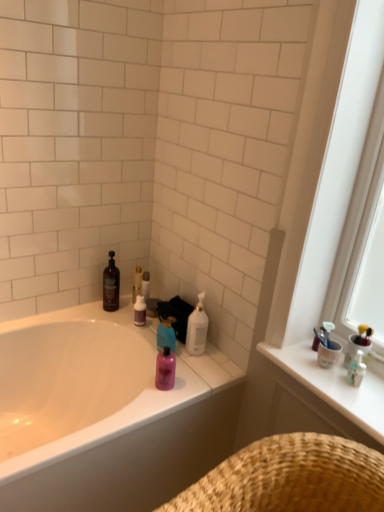
The image size is (384, 512). I want to click on free location in front of pink glossy bottle at center, the second toiletry viewed from the back, so click(153, 403).